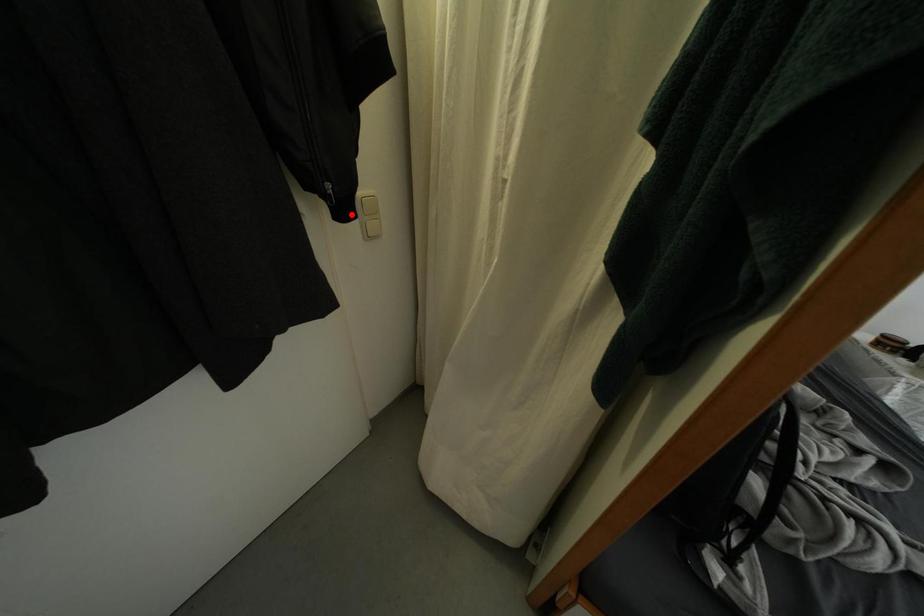
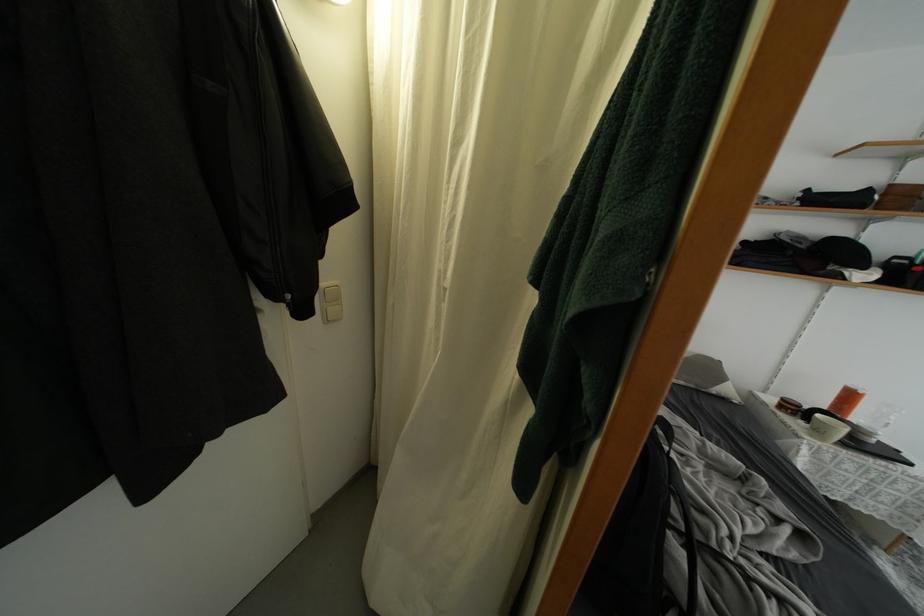
Where in the second image is the point corresponding to the highlighted location from the first image?

(310, 315)